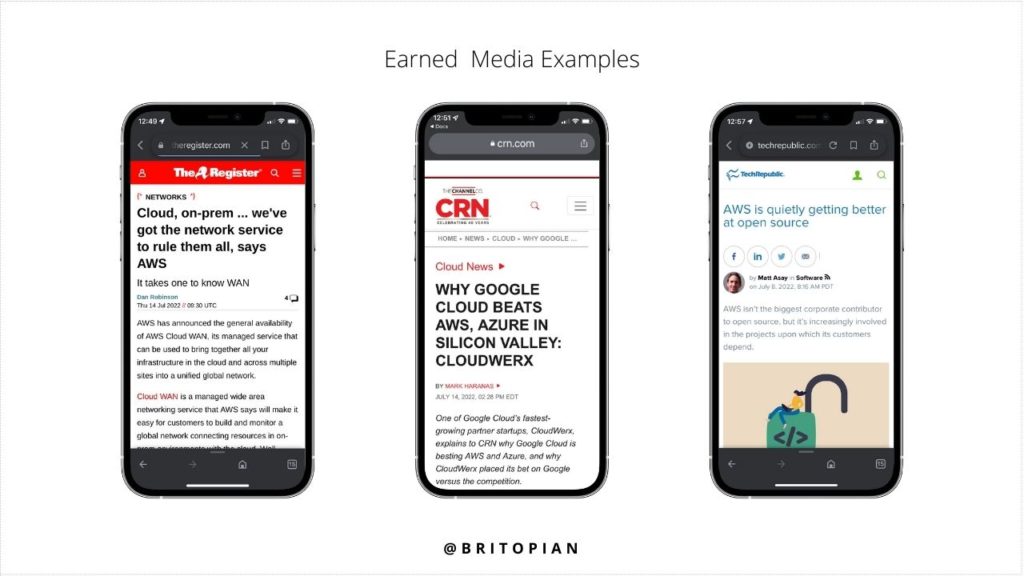
You are a GUI agent. You are given a task and a screenshot of the screen. Output one action in this format:
    pyautogui.click(x=<x>, y=<y>)
    Task: Click on the phone
    The height and width of the screenshot is (576, 1024).
    Given the screenshot: What is the action you would take?
    point(273,485), point(502,491), point(775,485)